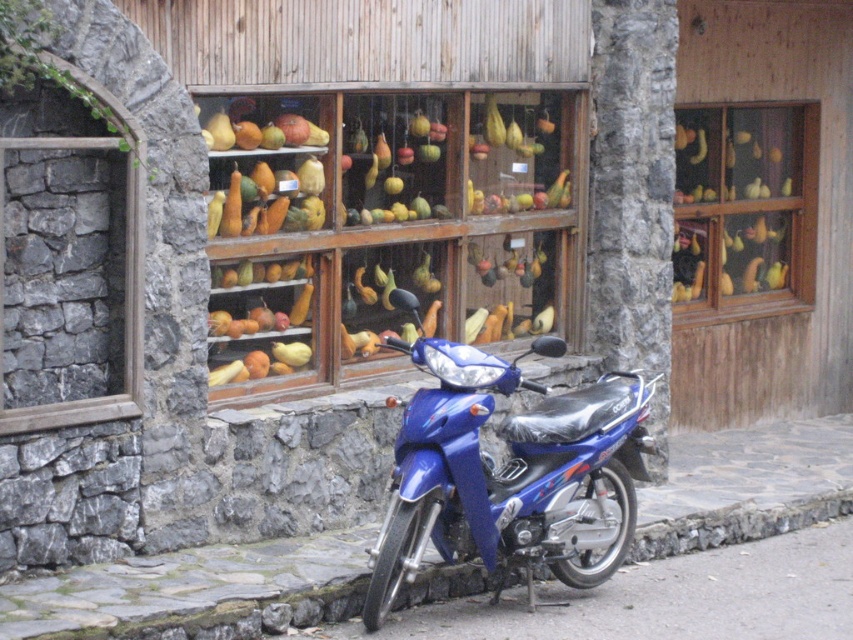
Question: Based on their relative distances, which object is farther from the yellow/golden wood at center?

Choices:
 (A) blue glossy motorcycle at center
 (B) wooden shelves at center
 (C) gray stone curb at lower center

Answer: (C)

Question: Which point is farther from the camera taking this photo?

Choices:
 (A) (367, 609)
 (B) (811, 209)
 (C) (109, 616)

Answer: (B)

Question: Which of the following is the farthest from the observer?

Choices:
 (A) yellow/golden wood at center
 (B) gray stone curb at lower center
 (C) blue glossy motorcycle at center

Answer: (A)

Question: Does wooden shelves at center appear over yellow/golden wood at center?

Choices:
 (A) no
 (B) yes

Answer: (A)

Question: From the image, what is the correct spatial relationship of blue glossy motorcycle at center in relation to yellow/golden wood at center?

Choices:
 (A) above
 (B) below

Answer: (B)

Question: Does wooden shelves at center appear over gray stone curb at lower center?

Choices:
 (A) no
 (B) yes

Answer: (B)